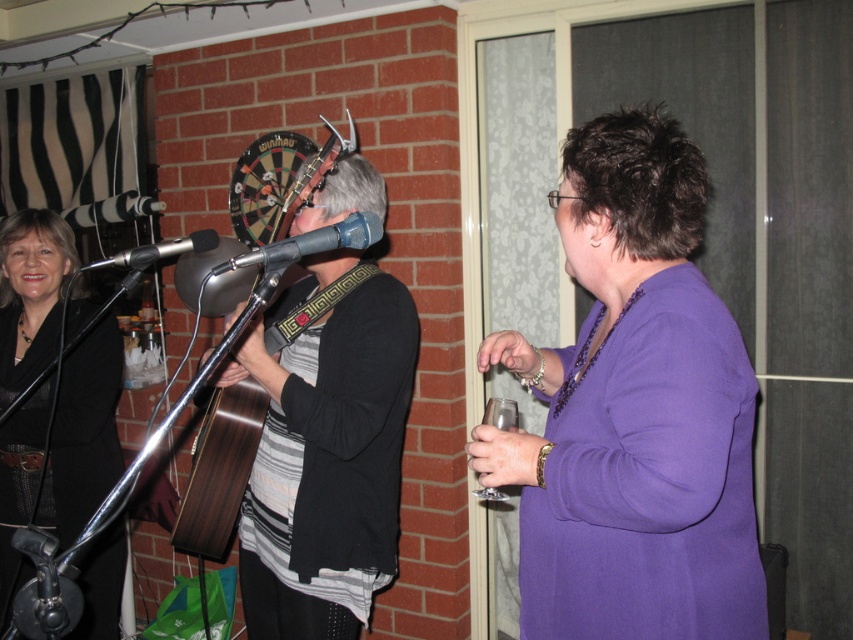
You are a photographer setting up for a group photo. You need to ensure that the purple matte dress at center and the matte plastic microphone at center are both visible in the frame. Based on their sizes, which object should you prioritize positioning closer to the camera to ensure it doesn not get obscured?

The purple matte dress at center is wider than the matte plastic microphone at center, so you should prioritize positioning the purple matte dress at center closer to the camera to ensure it doesn not get obscured.

You are a sound technician setting up for a live performance. You need to place a 1.2 meter wide amplifier between the striped fabric guitar at center and the matte plastic microphone at center. Can you fit it there?

The striped fabric guitar at center is wider than the matte plastic microphone at center. However, the combined width of both objects is not specified, so it is uncertain if the 1.2 meter wide amplifier can fit between them without overlapping. Additional measurements are needed.